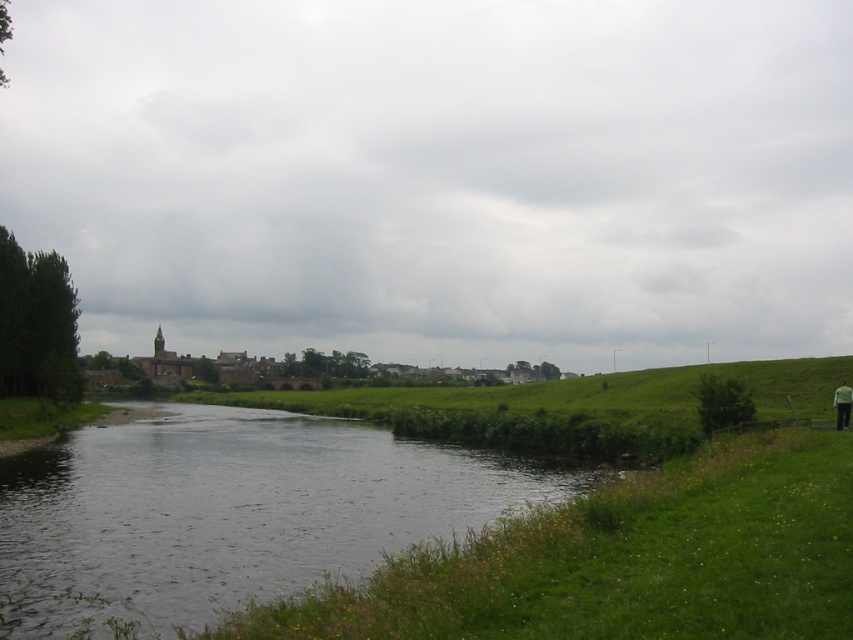
This screenshot has height=640, width=853. Describe the element at coordinates (621, 561) in the screenshot. I see `green grassy at lower right` at that location.

The height and width of the screenshot is (640, 853). I want to click on green grassy at lower right, so click(621, 561).

Identify the location of green grassy at lower right. (621, 561).